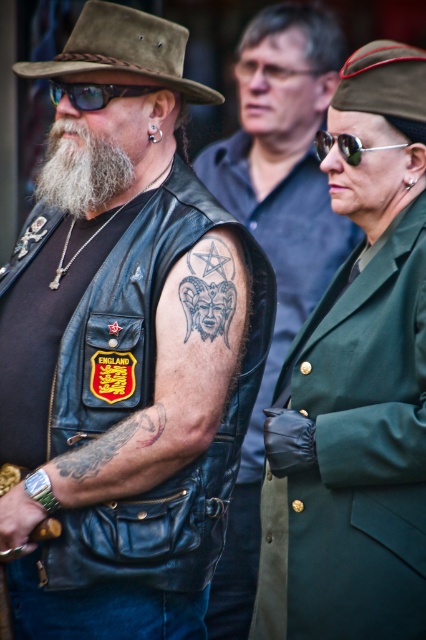
You are a photographer standing at the center of the scene. You need to capture a photo that includes both the black ink tattoo at upper right and the ENGLAND patch on the left individual. Can you fit both in your camera frame if your camera has a maximum view range of 15 feet?

The black ink tattoo at upper right and the ENGLAND patch on the left individual are 15.59 feet apart, which exceeds the camera frame range of 15 feet. Therefore, you cannot fit both in the frame.

You are standing in front of the three people in the image. Which of the two leather vests, the leather vest at center or the leather vest at left, is positioned closer to you?

The leather vest at center is closer to the viewer than the leather vest at left.